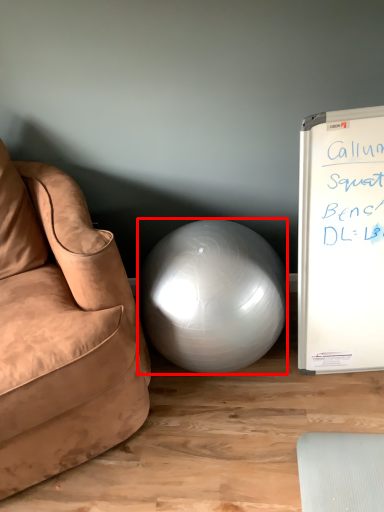
Question: From the image's perspective, what is the correct spatial relationship of ball (annotated by the red box) in relation to studio couch?

Choices:
 (A) above
 (B) below

Answer: (B)